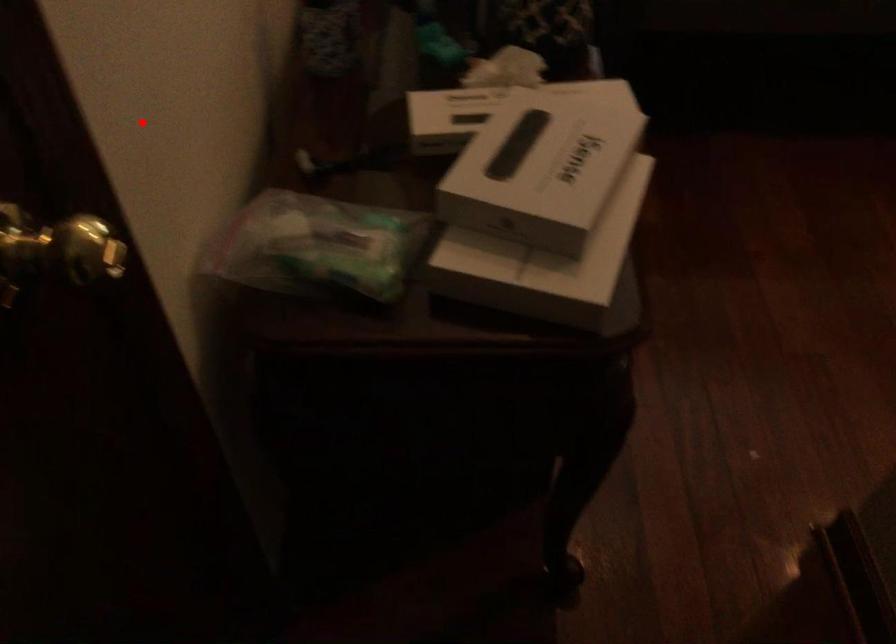
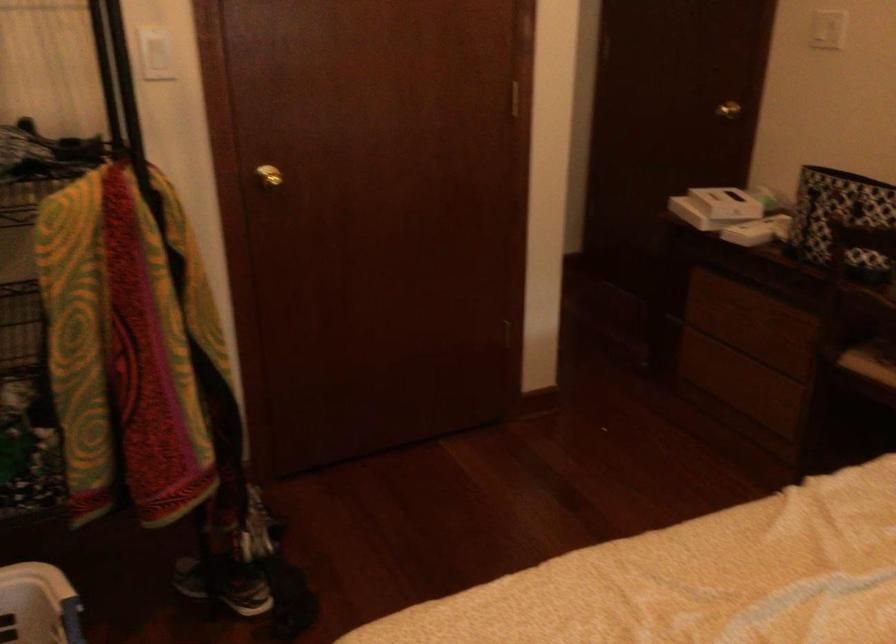
Locate, in the second image, the point that corresponds to the highlighted location in the first image.

(734, 106)